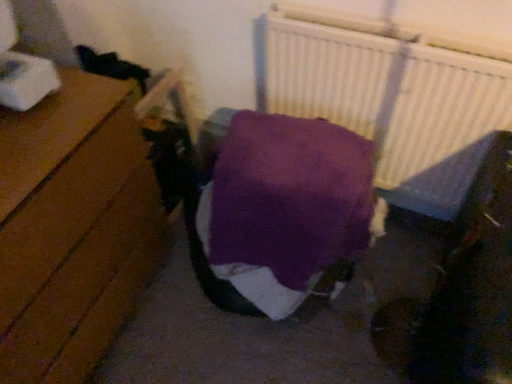
What do you see at coordinates (166, 99) in the screenshot?
I see `purple soft blanket at center` at bounding box center [166, 99].

Find the location of a particular element. purple soft blanket at center is located at coordinates (166, 99).

Locate an element on the screen. This screenshot has width=512, height=384. white textured radiator at upper right is located at coordinates (392, 94).

The height and width of the screenshot is (384, 512). Identify the location of purple soft blanket at center. (166, 99).

Does point (174, 102) come behind point (74, 306)?

Yes, point (174, 102) is farther from viewer.

Is purple soft blanket at center closer to the viewer compared to wooden floor at left?

No, purple soft blanket at center is further to the viewer.

From a real-world perspective, is purple soft blanket at center below wooden floor at left?

No, from a real-world perspective, purple soft blanket at center is not beneath wooden floor at left.

Between purple soft blanket at center and wooden floor at left, which one has smaller width?

wooden floor at left.

Considering the sizes of objects purple soft blanket at center and white textured radiator at upper right in the image provided, who is wider, purple soft blanket at center or white textured radiator at upper right?

Wider between the two is purple soft blanket at center.

Is white textured radiator at upper right completely or partially inside purple soft blanket at center?

No, white textured radiator at upper right is not a part of purple soft blanket at center.

Image resolution: width=512 pixels, height=384 pixels. In order to click on radiator behind the purple soft blanket at center in this screenshot , I will do `click(392, 94)`.

Would you say white textured radiator at upper right is to the left or to the right of purple soft blanket at center in the picture?

From the image, it's evident that white textured radiator at upper right is to the right of purple soft blanket at center.

Who is smaller, white textured radiator at upper right or purple soft blanket at center?

With smaller size is white textured radiator at upper right.

Is white textured radiator at upper right positioned far away from purple soft blanket at center?

No, white textured radiator at upper right is not far away from purple soft blanket at center.

How many degrees apart are the facing directions of white textured radiator at upper right and purple soft blanket at center?

There is a 4.54-degree angle between the facing directions of white textured radiator at upper right and purple soft blanket at center.

Is white textured radiator at upper right thinner than wooden floor at left?

Yes.

Could you tell me if white textured radiator at upper right is facing wooden floor at left?

Yes, white textured radiator at upper right is oriented towards wooden floor at left.

Which object is further away from the camera, wooden floor at left or purple soft blanket at center?

purple soft blanket at center is further from the camera.

Is wooden floor at left looking in the opposite direction of purple soft blanket at center?

No.

Does wooden floor at left have a smaller size compared to purple soft blanket at center?

Incorrect, wooden floor at left is not smaller in size than purple soft blanket at center.

Looking at this image, from the image's perspective, is wooden floor at left positioned above or below purple soft blanket at center?

Clearly, from the image's perspective, wooden floor at left is below purple soft blanket at center.

From the image's perspective, who appears lower, wooden floor at left or white textured radiator at upper right?

wooden floor at left, from the image's perspective.

Visually, is wooden floor at left positioned to the left or to the right of white textured radiator at upper right?

Clearly, wooden floor at left is on the left of white textured radiator at upper right in the image.

Does point (65, 228) lie in front of point (509, 66)?

Yes, point (65, 228) is in front of point (509, 66).

Is white textured radiator at upper right surrounded by wooden floor at left?

No, wooden floor at left does not contain white textured radiator at upper right.

Identify the location of furniture that appears in front of the purple soft blanket at center. This screenshot has height=384, width=512. (79, 252).

Find the location of `radiator positioned vertically above the purple soft blanket at center (from a real-world perspective)`. radiator positioned vertically above the purple soft blanket at center (from a real-world perspective) is located at coordinates (392, 94).

Which object lies nearer to the anchor point white textured radiator at upper right, wooden floor at left or purple soft blanket at center?

purple soft blanket at center is closer to white textured radiator at upper right.

Considering their positions, is white textured radiator at upper right positioned closer to purple soft blanket at center than wooden floor at left?

The object closer to purple soft blanket at center is wooden floor at left.

When comparing their distances from purple soft blanket at center, does wooden floor at left or white textured radiator at upper right seem further?

white textured radiator at upper right lies further to purple soft blanket at center than the other object.

Looking at the image, which one is located further to white textured radiator at upper right, purple soft blanket at center or wooden floor at left?

The object further to white textured radiator at upper right is wooden floor at left.

Estimate the real-world distances between objects in this image. Which object is closer to wooden floor at left, purple soft blanket at center or white textured radiator at upper right?

purple soft blanket at center is positioned closer to the anchor wooden floor at left.

When comparing their distances from wooden floor at left, does white textured radiator at upper right or purple soft blanket at center seem closer?

purple soft blanket at center is positioned closer to the anchor wooden floor at left.

Locate an element on the screen. This screenshot has width=512, height=384. bed situated between wooden floor at left and white textured radiator at upper right from left to right is located at coordinates (166, 99).